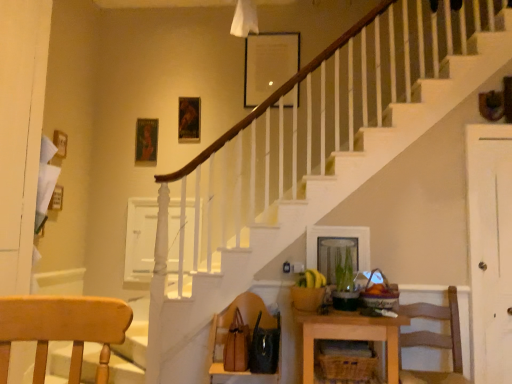
Image resolution: width=512 pixels, height=384 pixels. What do you see at coordinates (433, 341) in the screenshot? I see `wooden chair at lower right, marked as the 2th chair in a left-to-right arrangement` at bounding box center [433, 341].

Find the location of a particular element. Image resolution: width=512 pixels, height=384 pixels. white wood door at right is located at coordinates (490, 250).

At what (x,y) coordinates should I click in order to perform the action: click on brown leather handbag at lower center, the 1th chair when ordered from left to right. Please return your answer as a coordinate pair (x, y). The width and height of the screenshot is (512, 384). Looking at the image, I should click on (226, 335).

Considering the sizes of objects wooden table at lower center and white wood door at right in the image provided, who is smaller, wooden table at lower center or white wood door at right?

white wood door at right.

Considering the sizes of wooden table at lower center and white wood door at right in the image, is wooden table at lower center wider or thinner than white wood door at right?

In the image, wooden table at lower center appears to be wider than white wood door at right.

Between wooden table at lower center and white wood door at right, which one appears on the right side from the viewer's perspective?

white wood door at right.

Is white wood door at right behind wooden table at lower center?

Yes, white wood door at right is further from the viewer.

Is there a large distance between white wood door at right and wooden table at lower center?

Yes, white wood door at right and wooden table at lower center are quite far apart.

From the picture: Is white wood door at right wider or thinner than wooden table at lower center?

Clearly, white wood door at right has less width compared to wooden table at lower center.

Looking at this image, considering the relative sizes of wooden table at lower center and brown leather handbag at lower center, which ranks as the 2th chair in right-to-left order, in the image provided, is wooden table at lower center thinner than brown leather handbag at lower center, which ranks as the 2th chair in right-to-left order,?

No.

Based on the photo, how far apart are wooden table at lower center and brown leather handbag at lower center, which ranks as the 2th chair in right-to-left order?

A distance of 19.46 inches exists between wooden table at lower center and brown leather handbag at lower center, which ranks as the 2th chair in right-to-left order.

Which is correct: wooden table at lower center is inside brown leather handbag at lower center, the 1th chair when ordered from left to right, or outside of it?

wooden table at lower center is spatially situated outside brown leather handbag at lower center, the 1th chair when ordered from left to right.

From a real-world perspective, is wooden table at lower center on brown leather handbag at lower center, which ranks as the 2th chair in right-to-left order?

No, from a real-world perspective, wooden table at lower center is not on top of brown leather handbag at lower center, which ranks as the 2th chair in right-to-left order.

Is wooden table at lower center touching woven brown basket at lower center?

No.

Does wooden table at lower center have a greater width compared to woven brown basket at lower center?

Yes.

Is wooden table at lower center oriented away from woven brown basket at lower center?

That's right, wooden table at lower center is facing away from woven brown basket at lower center.

Which is in front, wooden table at lower center or woven brown basket at lower center?

wooden table at lower center is closer to the camera.

Is white wood door at right turned away from brown leather handbag at lower center, the 1th chair when ordered from left to right?

No, white wood door at right's orientation is not away from brown leather handbag at lower center, the 1th chair when ordered from left to right.

Which of these two, white wood door at right or brown leather handbag at lower center, the 1th chair when ordered from left to right, stands shorter?

With less height is brown leather handbag at lower center, the 1th chair when ordered from left to right.

Who is smaller, white wood door at right or brown leather handbag at lower center, the 1th chair when ordered from left to right?

With smaller size is white wood door at right.

Measure the distance between white wood door at right and brown leather handbag at lower center, the 1th chair when ordered from left to right.

white wood door at right and brown leather handbag at lower center, the 1th chair when ordered from left to right, are 5.30 feet apart from each other.

Consider the image. From a real-world perspective, between woven brown basket at lower center and wooden table at lower center, who is vertically lower?

wooden table at lower center, from a real-world perspective.

Considering the relative sizes of woven brown basket at lower center and wooden table at lower center in the image provided, is woven brown basket at lower center wider than wooden table at lower center?

No.

Is woven brown basket at lower center touching wooden table at lower center?

woven brown basket at lower center and wooden table at lower center are clearly separated.

Does point (318, 363) appear closer or farther from the camera than point (357, 335)?

Point (318, 363) is positioned farther from the camera compared to point (357, 335).

Which object is positioned more to the left, wooden chair at lower right, which ranks as the 1th chair in right-to-left order, or white wood door at right?

From the viewer's perspective, wooden chair at lower right, which ranks as the 1th chair in right-to-left order, appears more on the left side.

Considering the sizes of objects wooden chair at lower right, which ranks as the 1th chair in right-to-left order, and white wood door at right in the image provided, who is wider, wooden chair at lower right, which ranks as the 1th chair in right-to-left order, or white wood door at right?

With larger width is wooden chair at lower right, which ranks as the 1th chair in right-to-left order.

Where is `the 2nd chair in front when counting from the white wood door at right`? the 2nd chair in front when counting from the white wood door at right is located at coordinates (433, 341).

Image resolution: width=512 pixels, height=384 pixels. Identify the location of table on the left of white wood door at right. (349, 336).

At what (x,y) coordinates should I click in order to perform the action: click on table below the white wood door at right (from the image's perspective). Please return your answer as a coordinate pair (x, y). This screenshot has height=384, width=512. Looking at the image, I should click on (349, 336).

Which object lies further to the anchor point wooden chair at lower right, which ranks as the 1th chair in right-to-left order, wooden table at lower center or brown leather handbag at lower center, which ranks as the 2th chair in right-to-left order?

The object further to wooden chair at lower right, which ranks as the 1th chair in right-to-left order, is brown leather handbag at lower center, which ranks as the 2th chair in right-to-left order.

Considering their positions, is wooden chair at lower right, marked as the 2th chair in a left-to-right arrangement, positioned closer to wooden table at lower center than woven brown basket at lower center?

woven brown basket at lower center lies closer to wooden table at lower center than the other object.

Based on the photo, considering their positions, is wooden chair at lower right, which ranks as the 1th chair in right-to-left order, positioned closer to wooden table at lower center than white wood door at right?

wooden chair at lower right, which ranks as the 1th chair in right-to-left order, lies closer to wooden table at lower center than the other object.

From the image, which object appears to be nearer to wooden chair at lower right, which ranks as the 1th chair in right-to-left order, brown leather handbag at lower center, which ranks as the 2th chair in right-to-left order, or white wood door at right?

white wood door at right lies closer to wooden chair at lower right, which ranks as the 1th chair in right-to-left order, than the other object.

Which object lies further to the anchor point woven brown basket at lower center, white wood door at right or wooden chair at lower right, which ranks as the 1th chair in right-to-left order?

The object further to woven brown basket at lower center is white wood door at right.

Which object lies nearer to the anchor point brown leather handbag at lower center, the 1th chair when ordered from left to right, wooden chair at lower right, which ranks as the 1th chair in right-to-left order, or woven brown basket at lower center?

woven brown basket at lower center.

Which object lies further to the anchor point wooden chair at lower right, marked as the 2th chair in a left-to-right arrangement, woven brown basket at lower center or wooden table at lower center?

wooden table at lower center is further to wooden chair at lower right, marked as the 2th chair in a left-to-right arrangement.

Looking at the image, which one is located further to woven brown basket at lower center, wooden table at lower center or brown leather handbag at lower center, which ranks as the 2th chair in right-to-left order?

brown leather handbag at lower center, which ranks as the 2th chair in right-to-left order.

Where is `chair between woven brown basket at lower center and white wood door at right in the horizontal direction`? This screenshot has width=512, height=384. chair between woven brown basket at lower center and white wood door at right in the horizontal direction is located at coordinates (433, 341).

Identify the location of basket situated between brown leather handbag at lower center, the 1th chair when ordered from left to right, and white wood door at right from left to right. The width and height of the screenshot is (512, 384). (345, 368).

At what (x,y) coordinates should I click in order to perform the action: click on table between brown leather handbag at lower center, which ranks as the 2th chair in right-to-left order, and wooden chair at lower right, marked as the 2th chair in a left-to-right arrangement, from left to right. Please return your answer as a coordinate pair (x, y). Looking at the image, I should click on (349, 336).

The height and width of the screenshot is (384, 512). Find the location of `table between brown leather handbag at lower center, which ranks as the 2th chair in right-to-left order, and white wood door at right from left to right`. table between brown leather handbag at lower center, which ranks as the 2th chair in right-to-left order, and white wood door at right from left to right is located at coordinates (349, 336).